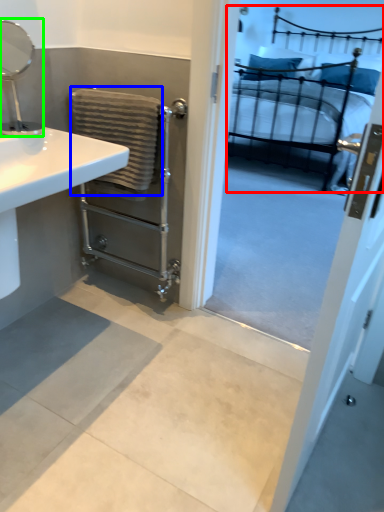
Question: Which is nearer to the bed (highlighted by a red box)? bath towel (highlighted by a blue box) or mirror (highlighted by a green box).

Choices:
 (A) bath towel
 (B) mirror

Answer: (A)